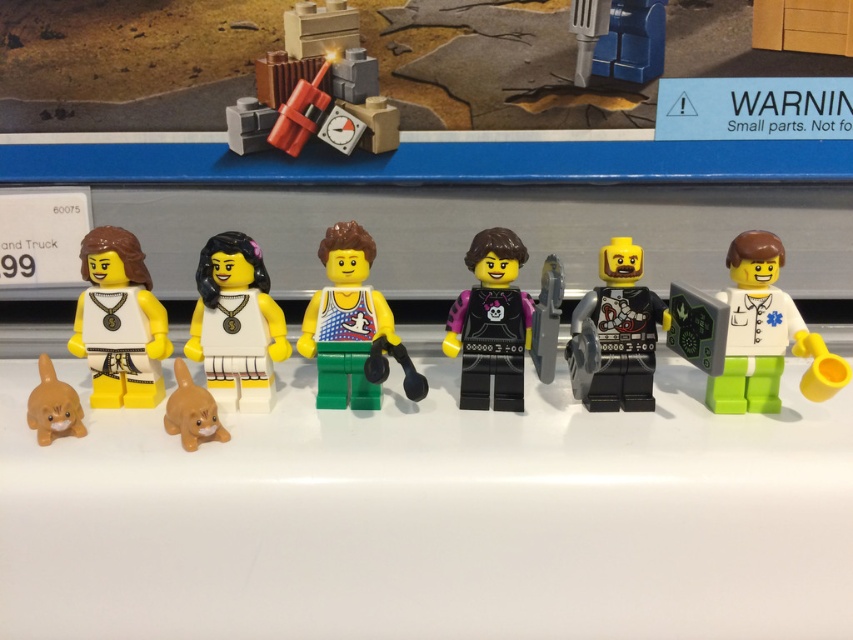
You are organizing a display of LEGO minifigures and need to arrange them in order from front to back. Given the white matte minifigure at left and the orange matte cat at center, which one should be placed first in the front row?

The white matte minifigure at left should be placed first in the front row because the orange matte cat at center is positioned behind it.

You are organizing a display of LEGO minifigures and need to place the white matte doctor at right and the orange matte cat at center into a narrow shelf. The shelf can only accommodate items up to 4 inches in width. Based on the description, can both fit side by side?

The white matte doctor at right might be wider than orange matte cat at center, so there is a possibility that the combined width of both items exceeds the shelf capacity. It is recommended to check their exact measurements before placing them together.

Looking at the LEGO minifigures arranged on the white surface, which object is positioned higher between the white matte minifigure at left and the orange matte cat at center?

The white matte minifigure at left is positioned above the orange matte cat at center.